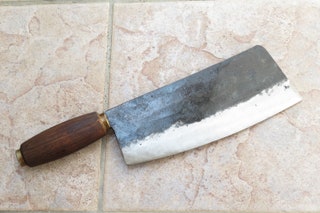
The height and width of the screenshot is (213, 320). In order to click on handle in this screenshot , I will do `click(58, 135)`.